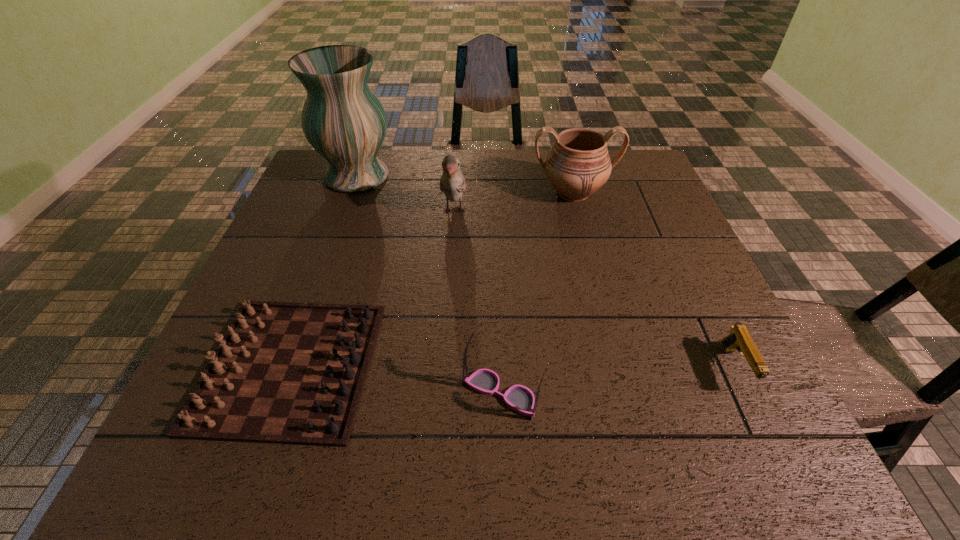
Where is `vacant space that is in between the fourth object from left to right and the vase`? vacant space that is in between the fourth object from left to right and the vase is located at coordinates (429, 285).

Where is `vacant point located between the pistol and the tallest object`? vacant point located between the pistol and the tallest object is located at coordinates (546, 272).

Locate an element on the screen. The width and height of the screenshot is (960, 540). free space between the chessboard and the tallest object is located at coordinates (324, 271).

In order to click on free space between the chessboard and the pistol in this screenshot , I will do `click(513, 367)`.

At what (x,y) coordinates should I click in order to perform the action: click on free area in between the pistol and the tallest object. Please return your answer as a coordinate pair (x, y). This screenshot has height=540, width=960. Looking at the image, I should click on (546, 272).

The image size is (960, 540). I want to click on free space between the pistol and the chessboard, so click(513, 367).

The image size is (960, 540). What are the coordinates of `free spot between the chessboard and the bird` in the screenshot? It's located at (372, 289).

Select which object is the third closest to the rightmost object. Please provide its 2D coordinates. Your answer should be formatted as a tuple, i.e. [(x, y)], where the tuple contains the x and y coordinates of a point satisfying the conditions above.

[(452, 183)]

Find the location of a particular element. object identified as the second closest to the pistol is located at coordinates (578, 164).

Locate an element on the screen. The image size is (960, 540). free spot that satisfies the following two spatial constraints: 1. at the face of the fourth tallest object; 2. on the left side of the bird is located at coordinates (442, 394).